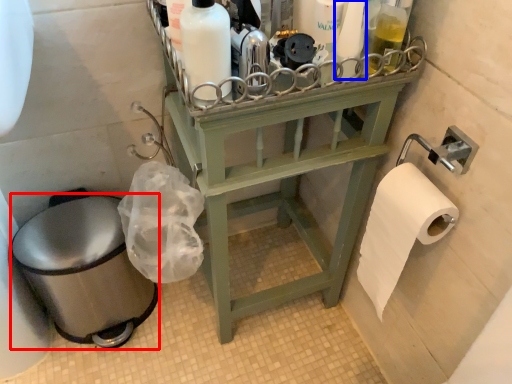
Question: Which point is further to the camera, toilet bowl (highlighted by a red box) or toiletry (highlighted by a blue box)?

Choices:
 (A) toilet bowl
 (B) toiletry

Answer: (A)